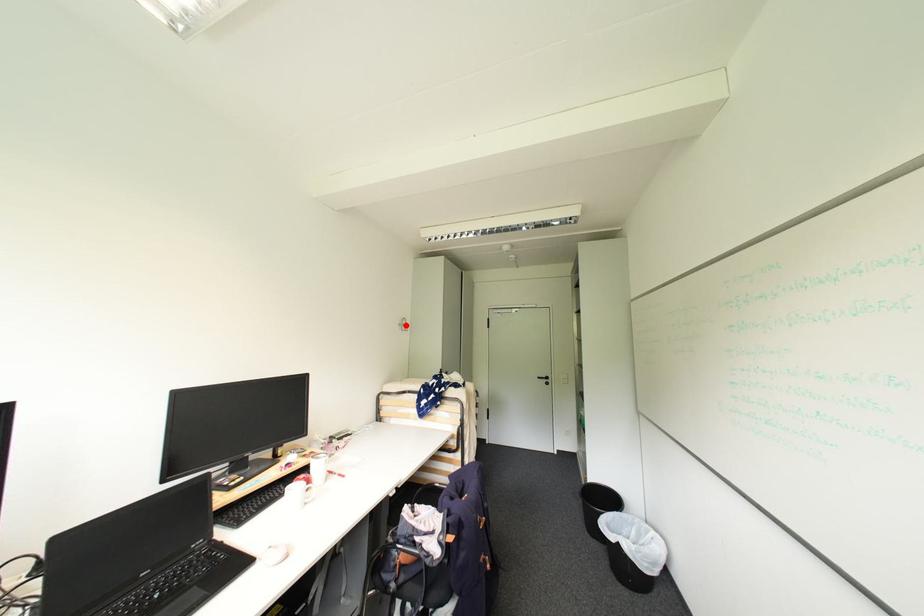
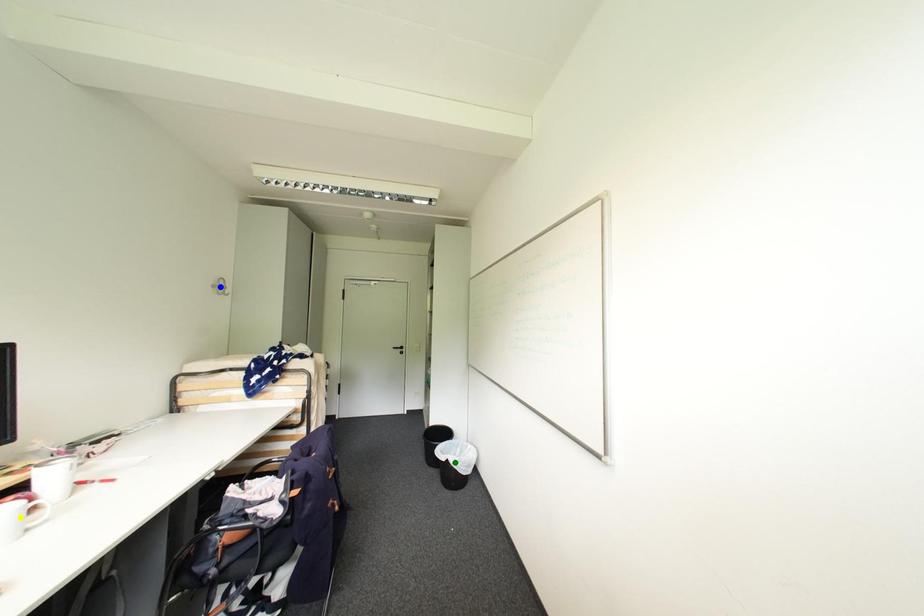
Question: I am providing you with two images of the same scene from different viewpoints. A red point is marked on the first image. You are given multiple points on the second image. Can you choose the point in image 2 that corresponds to the point in image 1?

Choices:
 (A) blue point
 (B) yellow point
 (C) green point

Answer: (A)